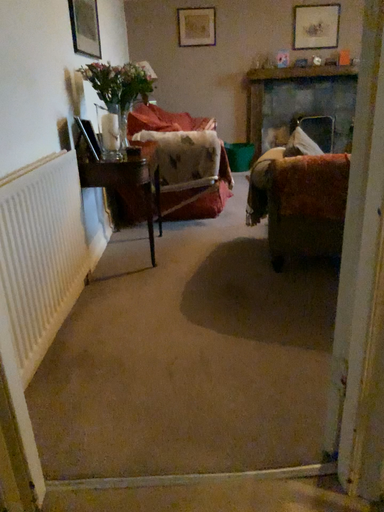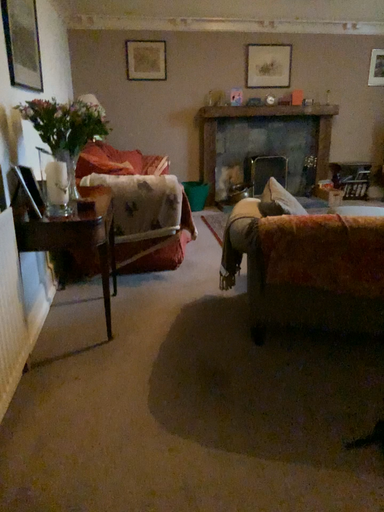
Question: How did the camera likely rotate when shooting the video?

Choices:
 (A) rotated right
 (B) rotated left

Answer: (A)